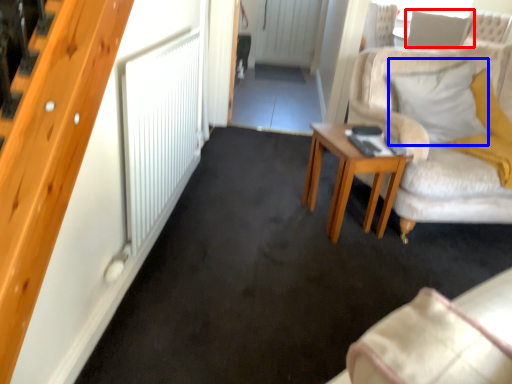
Question: Which object is closer to the camera taking this photo, pillow (highlighted by a red box) or pillow (highlighted by a blue box)?

Choices:
 (A) pillow
 (B) pillow

Answer: (B)